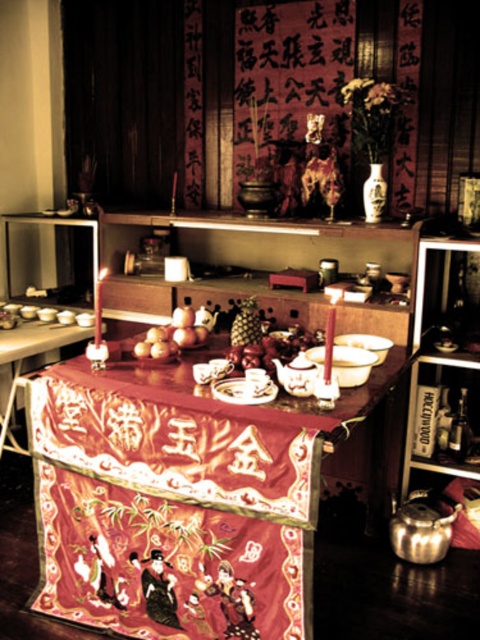
You are standing in front of the traditional Chinese altar and want to place a small offering between the two points marked as point (271, 339) and point (152, 346). Which point should you move toward to place the offering closer to the viewer?

You should move toward point (271, 339) because it is closer to the viewer compared to point (152, 346).

You are an altar attendant who needs to place a new offering on the altar. The offering is a small statue that must be placed above the smooth golden apples at center. Can you place it on the silky red tablecloth at center?

The silky red tablecloth at center has a greater height compared to smooth golden apples at center, so yes, the statue can be placed on the silky red tablecloth at center above the smooth golden apples at center.

You are standing in front of a traditional Chinese altar. You need to place a 2.1 meter long decorative scroll on the silky red tablecloth at center. Can you fit the scroll on the tablecloth without bending it?

The silky red tablecloth at center is 2.01 meters away from the viewer, but this distance does not indicate its length. The question about fitting a 2.1 meter scroll cannot be answered with the provided information.